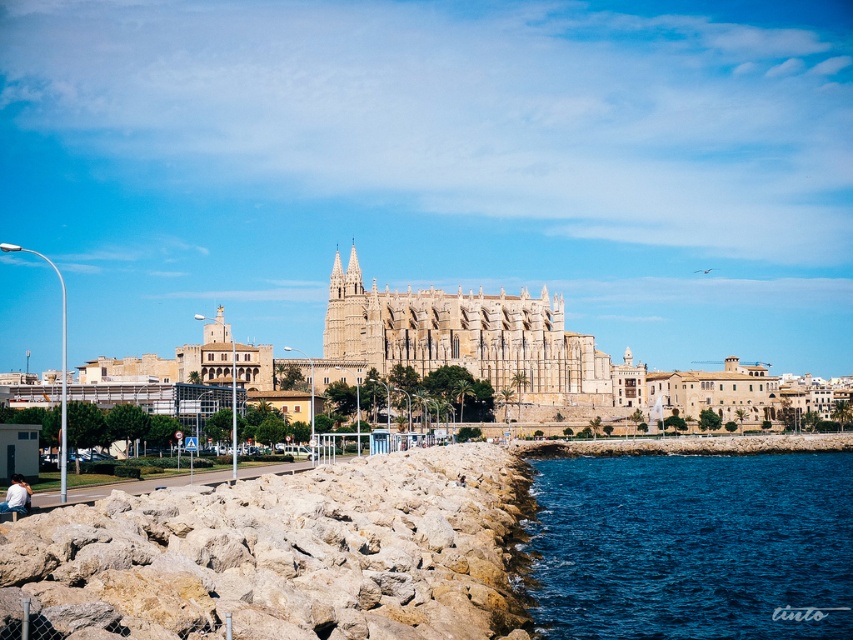
Question: Among these objects, which one is farthest from the camera?

Choices:
 (A) rocky at lower left
 (B) blue liquid water at lower right

Answer: (B)

Question: Which of the following is the farthest from the observer?

Choices:
 (A) rocky at lower left
 (B) white cotton shirt at lower left

Answer: (B)

Question: Is rocky at lower left to the right of blue liquid water at lower right from the viewer's perspective?

Choices:
 (A) no
 (B) yes

Answer: (A)

Question: From the image, what is the correct spatial relationship of blue liquid water at lower right in relation to white cotton shirt at lower left?

Choices:
 (A) left
 (B) right

Answer: (B)

Question: Can you confirm if blue liquid water at lower right is positioned below white cotton shirt at lower left?

Choices:
 (A) no
 (B) yes

Answer: (B)

Question: Which object is farther from the camera taking this photo?

Choices:
 (A) rocky at lower left
 (B) white cotton shirt at lower left
 (C) blue liquid water at lower right

Answer: (C)